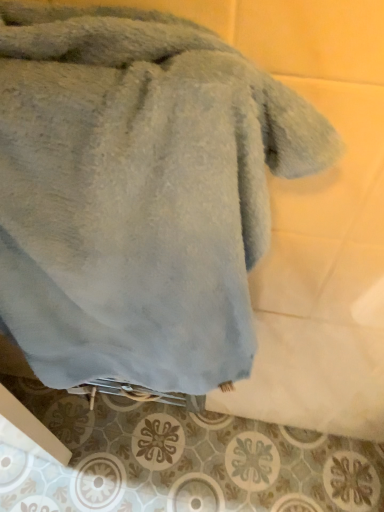
Question: Should I look upward or downward to see light blue plush towel at center?

Choices:
 (A) up
 (B) down

Answer: (B)